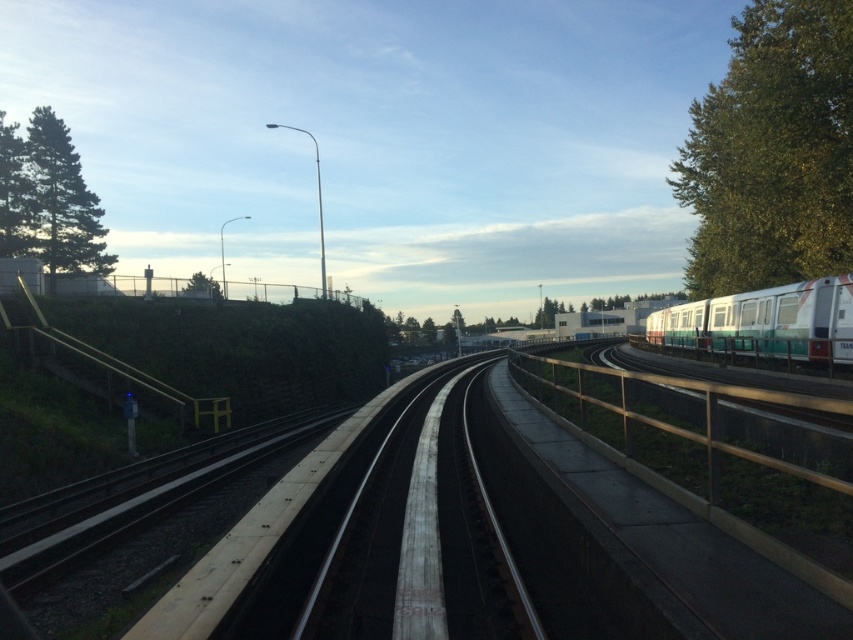
Question: Which of the following is the closest to the observer?

Choices:
 (A) green leafy tree at upper right
 (B) green matte tree at upper left
 (C) white glossy passenger train at right

Answer: (C)

Question: Can you confirm if green leafy tree at upper right is positioned to the right of green leafy tree at left?

Choices:
 (A) yes
 (B) no

Answer: (A)

Question: Based on their relative distances, which object is nearer to the green matte tree at upper left?

Choices:
 (A) green leafy tree at left
 (B) white glossy passenger train at right
 (C) green leafy tree at upper right

Answer: (A)

Question: Does green matte tree at upper left have a smaller size compared to white glossy passenger train at right?

Choices:
 (A) no
 (B) yes

Answer: (A)

Question: Which point is farther to the camera?

Choices:
 (A) (787, 145)
 (B) (9, 196)
 (C) (848, 307)
 (D) (74, 234)

Answer: (D)

Question: Is white glossy passenger train at right positioned behind green leafy tree at left?

Choices:
 (A) no
 (B) yes

Answer: (A)